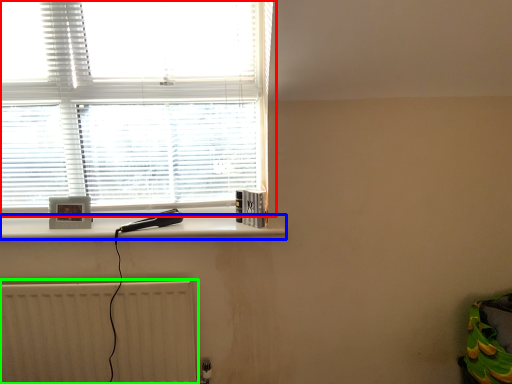
Question: Which is farther away from window (highlighted by a red box)? ledge (highlighted by a blue box) or radiator (highlighted by a green box)?

Choices:
 (A) ledge
 (B) radiator

Answer: (B)